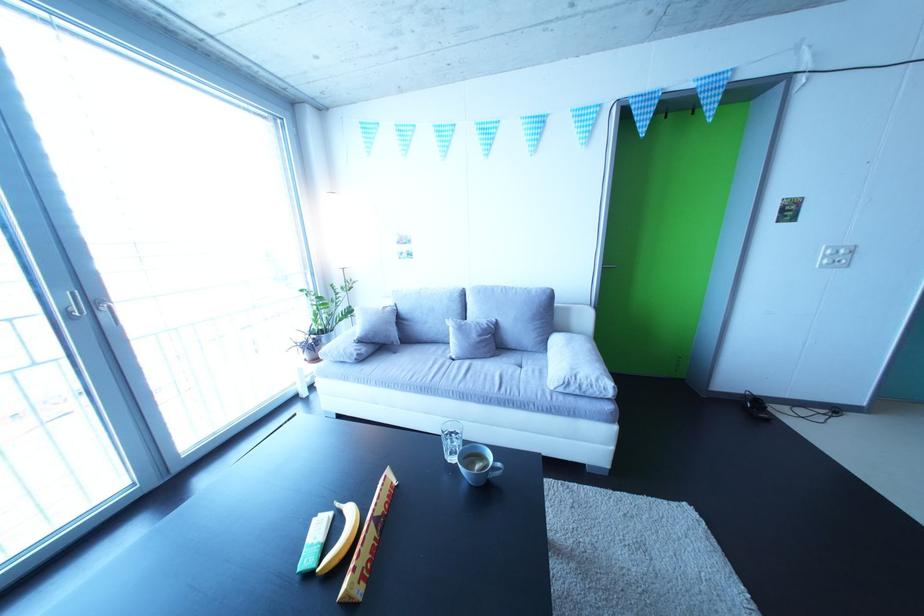
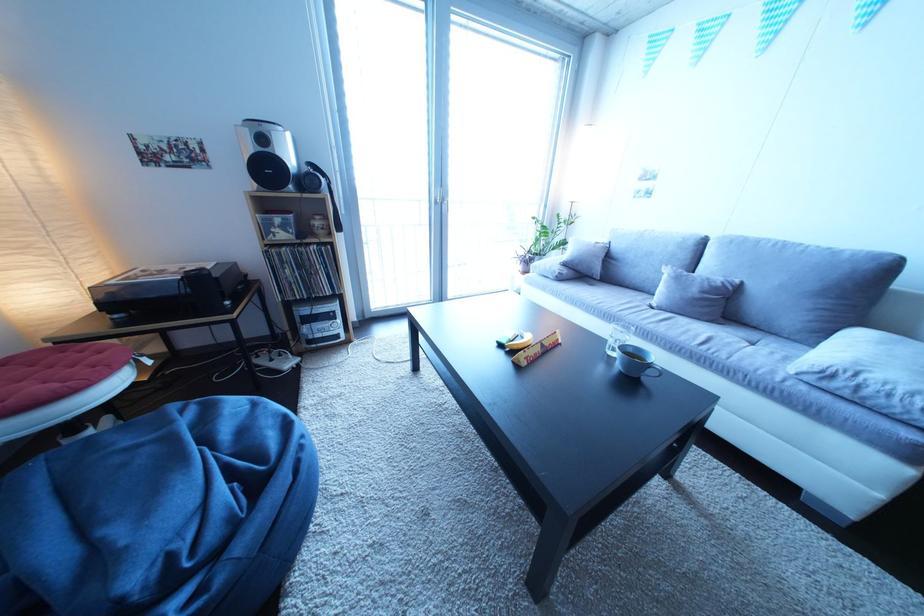
Where in the second image is the point corresponding to the point at 349,569 from the first image?

(529, 353)